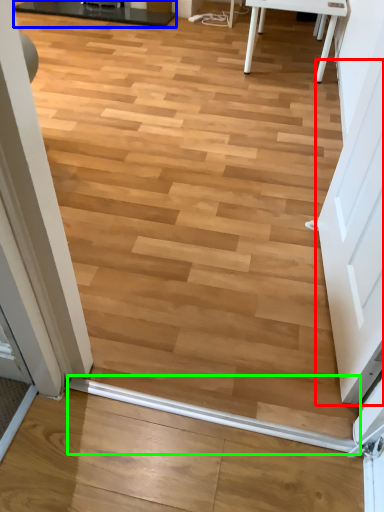
Question: Which is farther away from screen door (highlighted by a red box)? table (highlighted by a blue box) or beam (highlighted by a green box)?

Choices:
 (A) table
 (B) beam

Answer: (A)